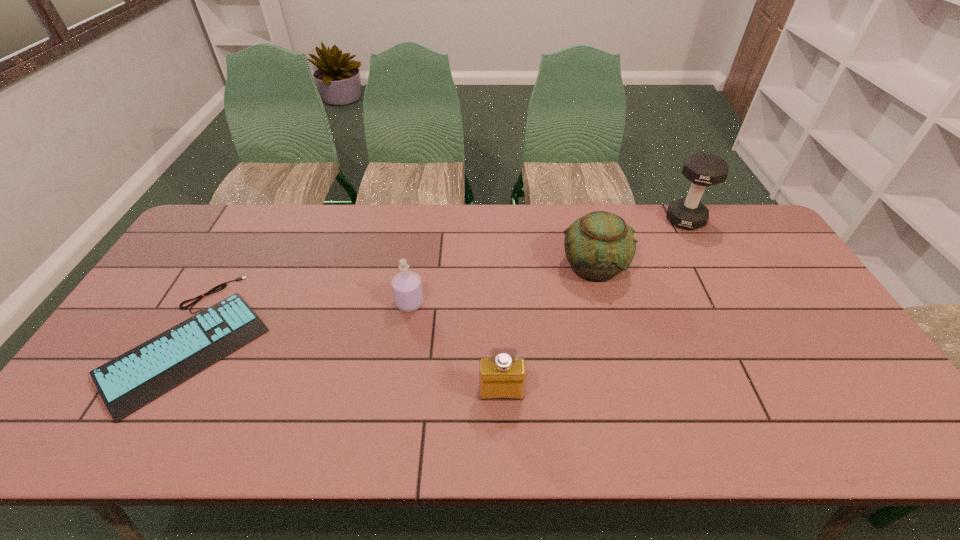
This screenshot has width=960, height=540. I want to click on the tallest object, so click(702, 169).

Image resolution: width=960 pixels, height=540 pixels. What are the coordinates of `the farthest object` in the screenshot? It's located at (702, 169).

I want to click on pottery, so click(x=598, y=246).

You are a GUI agent. You are given a task and a screenshot of the screen. Output one action in this format:
    pyautogui.click(x=<x>, y=<y>)
    Task: Click on the farther perfume
    
    Given the screenshot: What is the action you would take?
    pyautogui.click(x=407, y=288)

This screenshot has width=960, height=540. I want to click on the left perfume, so click(407, 288).

This screenshot has width=960, height=540. Find the location of `the right perfume`. the right perfume is located at coordinates (503, 376).

You are a GUI agent. You are given a task and a screenshot of the screen. Output one action in this format:
    pyautogui.click(x=<x>, y=<y>)
    Task: Click on the nearer perfume
    The height and width of the screenshot is (540, 960).
    Given the screenshot: What is the action you would take?
    pyautogui.click(x=503, y=376)

You are a GUI agent. You are given a task and a screenshot of the screen. Output one action in this format:
    pyautogui.click(x=<x>, y=<y>)
    Task: Click on the leftmost object
    
    Given the screenshot: What is the action you would take?
    pyautogui.click(x=128, y=382)

I want to click on the shortest object, so click(128, 382).

This screenshot has height=540, width=960. What are the coordinates of `free location located 0.310m on the left of the farthest object` in the screenshot? It's located at (576, 220).